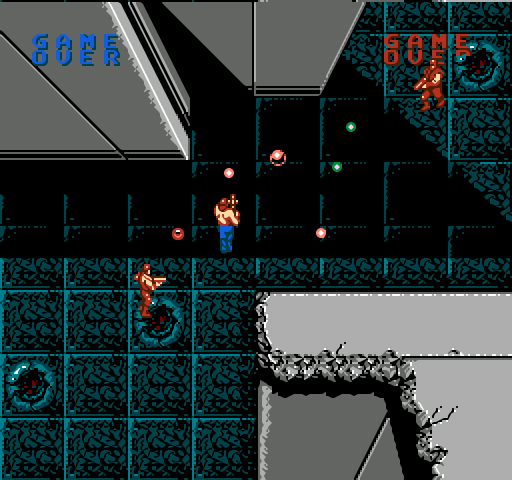
Locate an element on the screen. This screenshot has height=480, width=512. wall is located at coordinates (82, 169).